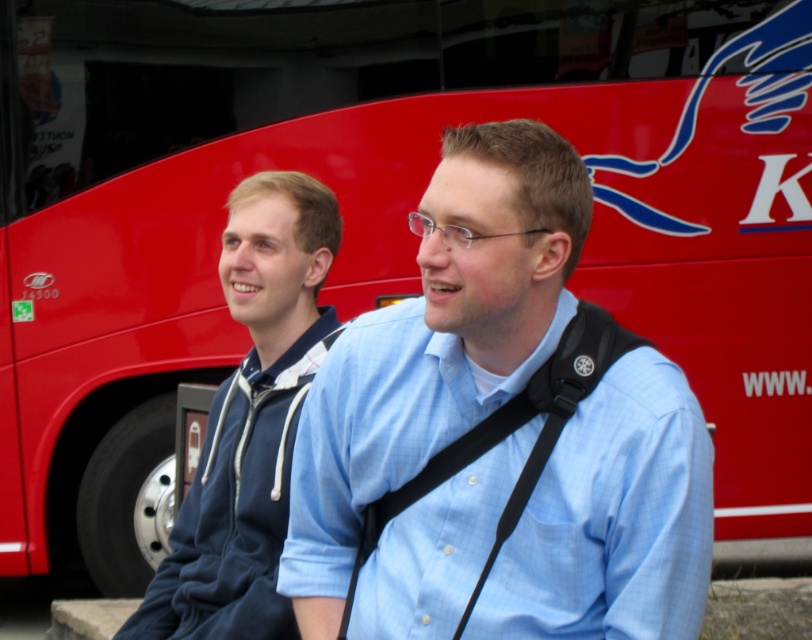
You are a photographer trying to capture a candid shot of the light blue shirt at center and the black fabric strap at center. Based on their positions, which object is closer to the right side of the frame?

The light blue shirt at center is closer to the right side of the frame because it is positioned to the right of the black fabric strap at center.

You are a photographer trying to capture a clear shot of the light blue shirt at center and the black fabric strap at center. Which object is closer to the camera?

The light blue shirt at center is closer to the camera because it is in front of the black fabric strap at center.